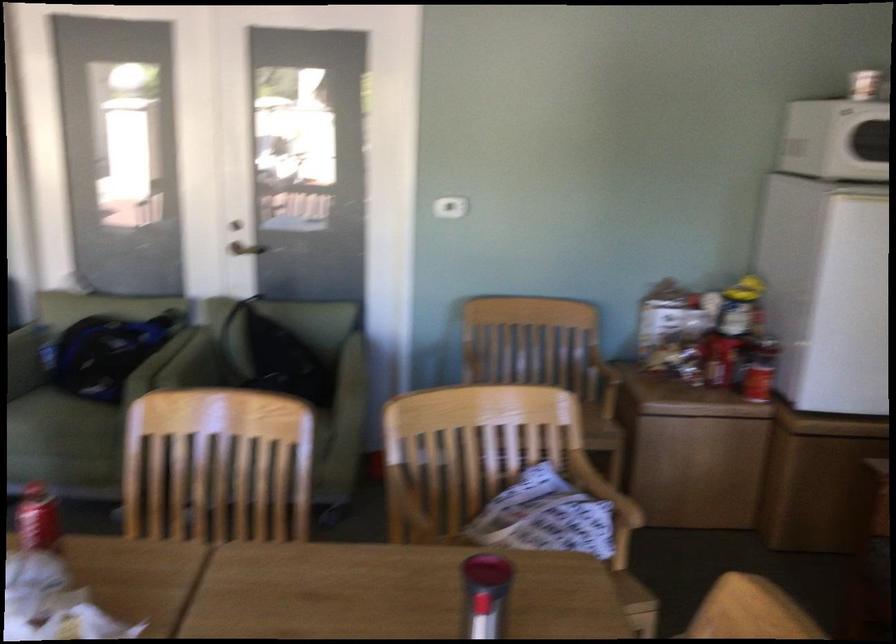
Where would you pull the metal door handle? Please return your answer as a coordinate pair (x, y).

(246, 249)